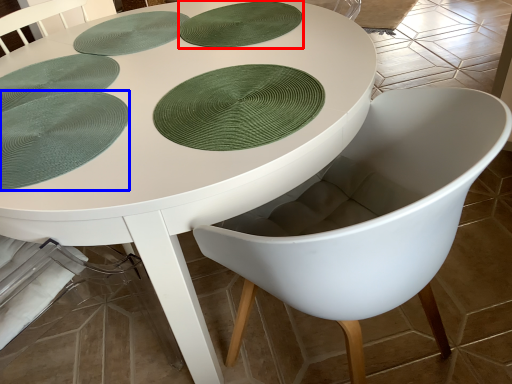
Question: Which object appears closest to the camera in this image, paper plate (highlighted by a red box) or paper plate (highlighted by a blue box)?

Choices:
 (A) paper plate
 (B) paper plate

Answer: (B)